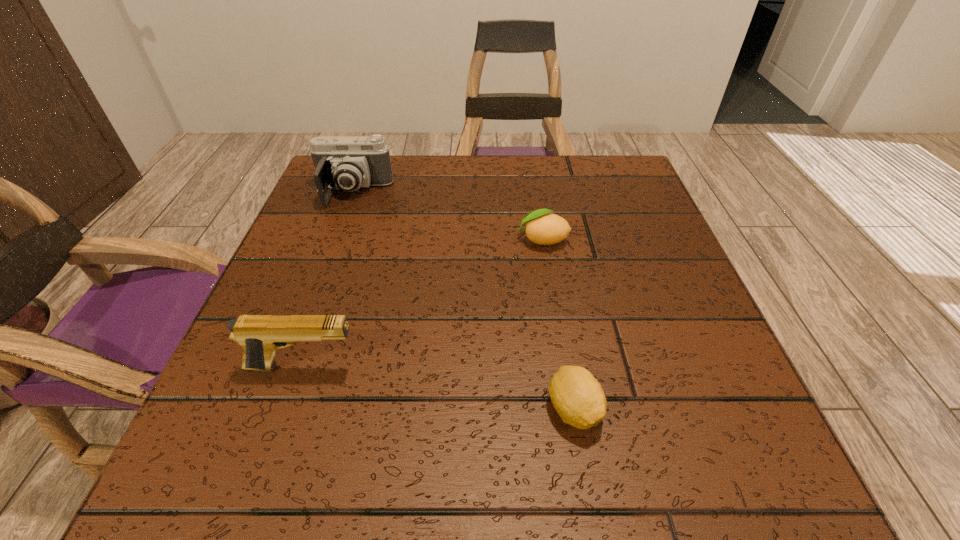
Identify the location of the farthest object. (343, 162).

Find the location of a particular element. Image resolution: width=960 pixels, height=540 pixels. the second nearest object is located at coordinates (260, 335).

Identify the location of the second farthest object. (543, 228).

You are a GUI agent. You are given a task and a screenshot of the screen. Output one action in this format:
    pyautogui.click(x=<x>, y=<y>)
    Task: Click on the nearest object
    
    Given the screenshot: What is the action you would take?
    pyautogui.click(x=577, y=396)

Locate an element on the screen. vacant area situated 0.390m at the front of the farthest object with an open lens cover is located at coordinates (293, 355).

The height and width of the screenshot is (540, 960). I want to click on vacant space located 0.290m at the barrel of the pistol, so click(549, 367).

Image resolution: width=960 pixels, height=540 pixels. I want to click on free space located with leaves positioned above the farther lemon, so click(451, 240).

Identify the location of vacant space located with leaves positioned above the farther lemon. Image resolution: width=960 pixels, height=540 pixels. (363, 240).

Where is `free point located with leaves positioned above the farther lemon`? The height and width of the screenshot is (540, 960). free point located with leaves positioned above the farther lemon is located at coordinates (388, 240).

In order to click on object that is at the far edge in this screenshot , I will do `click(343, 162)`.